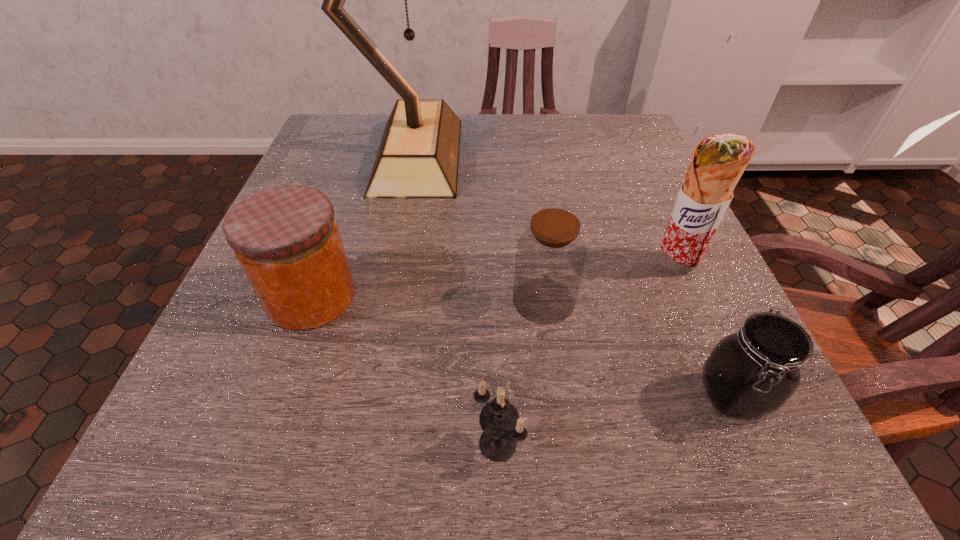
This screenshot has width=960, height=540. Find the location of `jar that is at the right edge`. jar that is at the right edge is located at coordinates (751, 373).

Find the location of a particular element. Image resolution: width=960 pixels, height=540 pixels. object that is positioned at the far left corner is located at coordinates (418, 157).

Locate an element on the screen. This screenshot has height=540, width=960. object that is at the near right corner is located at coordinates (751, 373).

Image resolution: width=960 pixels, height=540 pixels. Identify the location of vacant space at the far edge of the desktop. (481, 124).

The height and width of the screenshot is (540, 960). I want to click on free space at the near edge, so click(471, 440).

The height and width of the screenshot is (540, 960). In the image, there is a desktop. What are the coordinates of `free space at the left edge` in the screenshot? It's located at (330, 178).

The height and width of the screenshot is (540, 960). In the image, there is a desktop. What are the coordinates of `vacant space at the right edge` in the screenshot? It's located at (637, 292).

What are the coordinates of `blank area at the far left corner` in the screenshot? It's located at (336, 134).

Locate an element on the screen. free point at the far right corner is located at coordinates (620, 151).

The width and height of the screenshot is (960, 540). I want to click on empty location between the third object from right to left and the second tallest object, so click(x=610, y=282).